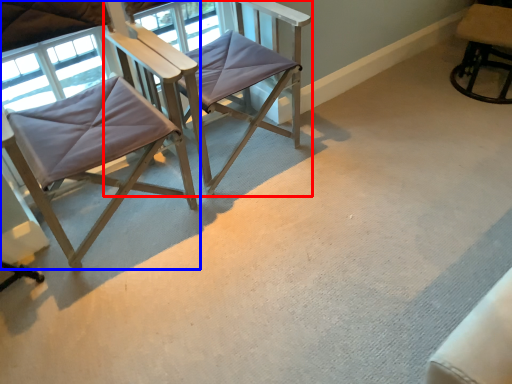
Question: Which point is further to the camera, chair (highlighted by a red box) or chair (highlighted by a blue box)?

Choices:
 (A) chair
 (B) chair

Answer: (A)